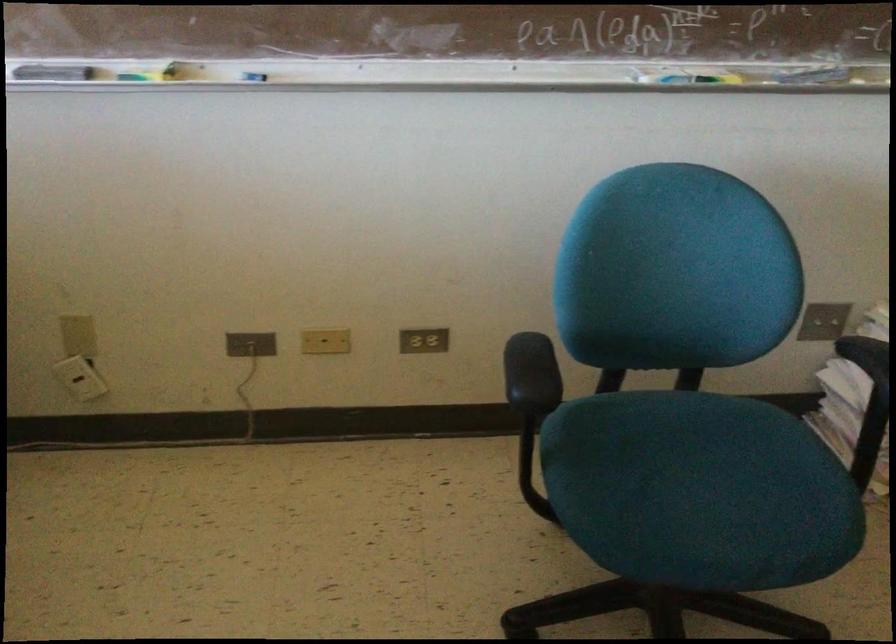
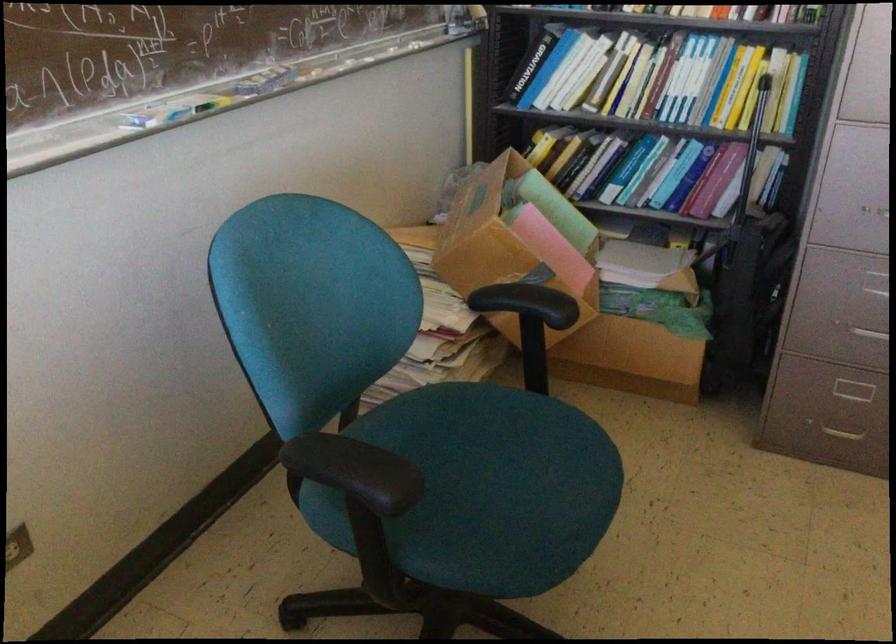
Locate, in the second image, the point that corresponds to point (724, 473) in the first image.

(498, 458)